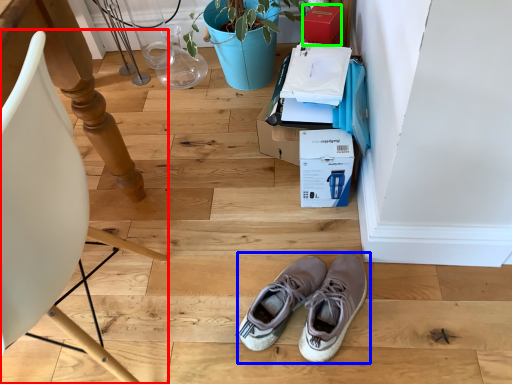
Question: Which object is the farthest from chair (highlighted by a red box)? Choose among these: footwear (highlighted by a blue box) or cardboard box (highlighted by a green box).

Choices:
 (A) footwear
 (B) cardboard box

Answer: (B)